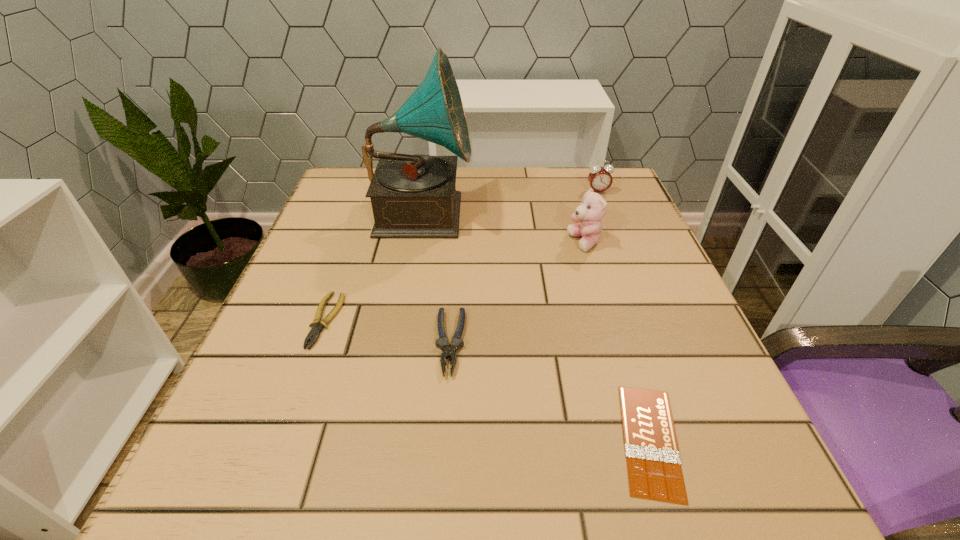
Locate an element on the screen. This screenshot has width=960, height=540. free location located at the face of the second tallest object is located at coordinates (489, 243).

Identify the location of vacant space located at the face of the second tallest object. (526, 243).

The image size is (960, 540). In order to click on vacant space located at the face of the second tallest object in this screenshot , I will do `click(414, 243)`.

In order to click on free point located 0.210m on the clock face of the alarm clock in this screenshot , I will do `click(619, 246)`.

This screenshot has width=960, height=540. In order to click on vacant space located 0.180m at the gripping part of the third shortest object in this screenshot , I will do `click(440, 500)`.

Locate an element on the screen. vacant space located on the right of the left pliers is located at coordinates (384, 321).

Identify the location of blank space located 0.380m on the back of the nearest object. This screenshot has height=540, width=960. (588, 240).

Find the location of `record player located at the far edge`. record player located at the far edge is located at coordinates (413, 196).

Image resolution: width=960 pixels, height=540 pixels. Identify the location of alarm clock present at the far edge. (600, 179).

This screenshot has height=540, width=960. Identify the location of object at the near edge. (654, 469).